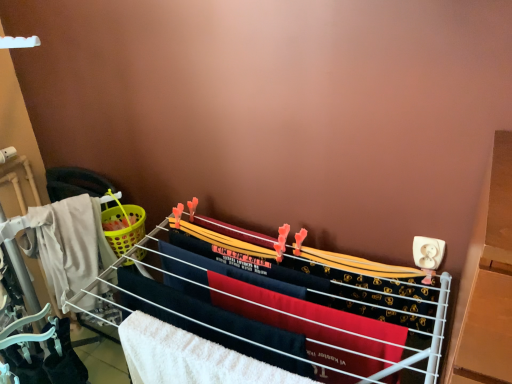
At what (x,y) coordinates should I click in order to perform the action: click on white fluffy beach towel at center. Please return your answer as a coordinate pair (x, y). The height and width of the screenshot is (384, 512). Looking at the image, I should click on (189, 357).

What do you see at coordinates (189, 357) in the screenshot? The height and width of the screenshot is (384, 512). I see `white fluffy beach towel at center` at bounding box center [189, 357].

Locate an element on the screen. The width and height of the screenshot is (512, 384). white fabric drying rack at center is located at coordinates (432, 339).

Describe the element at coordinates (432, 339) in the screenshot. I see `white fabric drying rack at center` at that location.

What are the coordinates of `white fluffy beach towel at center` in the screenshot? It's located at (189, 357).

Considering the relative positions of white fluffy beach towel at center and white fabric drying rack at center in the image provided, is white fluffy beach towel at center to the left of white fabric drying rack at center from the viewer's perspective?

Indeed, white fluffy beach towel at center is positioned on the left side of white fabric drying rack at center.

Is white fluffy beach towel at center positioned in front of white fabric drying rack at center?

No.

Consider the image. Which point is more distant from viewer, (243, 379) or (392, 371)?

The point (392, 371) is farther.

From the image's perspective, between white fluffy beach towel at center and white fabric drying rack at center, who is located below?

white fabric drying rack at center appears lower in the image.

From a real-world perspective, which is physically above, white fluffy beach towel at center or white fabric drying rack at center?

white fluffy beach towel at center is physically above.

Considering the relative sizes of white fluffy beach towel at center and white fabric drying rack at center in the image provided, is white fluffy beach towel at center thinner than white fabric drying rack at center?

Indeed, white fluffy beach towel at center has a lesser width compared to white fabric drying rack at center.

Considering the sizes of white fluffy beach towel at center and white fabric drying rack at center in the image, is white fluffy beach towel at center taller or shorter than white fabric drying rack at center?

white fluffy beach towel at center is shorter than white fabric drying rack at center.

Is white fluffy beach towel at center smaller than white fabric drying rack at center?

Yes, white fluffy beach towel at center is smaller than white fabric drying rack at center.

Based on the photo, would you say white fabric drying rack at center is part of white fluffy beach towel at center's contents?

Actually, white fabric drying rack at center is outside white fluffy beach towel at center.

Looking at this image, are white fluffy beach towel at center and white fabric drying rack at center far apart?

That's not correct — white fluffy beach towel at center is a little close to white fabric drying rack at center.

Is white fluffy beach towel at center oriented away from white fabric drying rack at center?

Correct, white fluffy beach towel at center is looking away from white fabric drying rack at center.

Can you tell me how much white fluffy beach towel at center and white fabric drying rack at center differ in facing direction?

1.86 degrees separate the facing orientations of white fluffy beach towel at center and white fabric drying rack at center.

How distant is white fluffy beach towel at center from white fabric drying rack at center?

white fluffy beach towel at center and white fabric drying rack at center are 11.36 inches apart from each other.

Locate an element on the screen. furniture below the white fluffy beach towel at center (from a real-world perspective) is located at coordinates (432, 339).

Which is more to the right, white fabric drying rack at center or white fluffy beach towel at center?

white fabric drying rack at center.

Considering the relative positions of white fabric drying rack at center and white fluffy beach towel at center in the image provided, is white fabric drying rack at center in front of white fluffy beach towel at center?

Yes, white fabric drying rack at center is in front of white fluffy beach towel at center.

Is point (436, 328) behind point (184, 369)?

That is False.

From the image's perspective, between white fabric drying rack at center and white fluffy beach towel at center, who is located below?

white fabric drying rack at center is shown below in the image.

Based on the photo, from a real-world perspective, which object rests below the other?

From a 3D spatial view, white fabric drying rack at center is below.

Between white fabric drying rack at center and white fluffy beach towel at center, which one has larger width?

white fabric drying rack at center.

Considering the relative sizes of white fabric drying rack at center and white fluffy beach towel at center in the image provided, is white fabric drying rack at center taller than white fluffy beach towel at center?

Correct, white fabric drying rack at center is much taller as white fluffy beach towel at center.

Is white fabric drying rack at center smaller than white fluffy beach towel at center?

Incorrect, white fabric drying rack at center is not smaller in size than white fluffy beach towel at center.

Does white fabric drying rack at center contain white fluffy beach towel at center?

Yes.

Is white fabric drying rack at center touching white fluffy beach towel at center?

No, white fabric drying rack at center is not in contact with white fluffy beach towel at center.

Is white fabric drying rack at center facing towards white fluffy beach towel at center?

Yes, white fabric drying rack at center is oriented towards white fluffy beach towel at center.

Can you tell me how much white fabric drying rack at center and white fluffy beach towel at center differ in facing direction?

There is a 1.86-degree angle between the facing directions of white fabric drying rack at center and white fluffy beach towel at center.

Image resolution: width=512 pixels, height=384 pixels. Identify the location of furniture on the right of the white fluffy beach towel at center. (432, 339).

This screenshot has width=512, height=384. I want to click on furniture that is under the white fluffy beach towel at center (from a real-world perspective), so click(x=432, y=339).

Identify the location of furniture below the white fluffy beach towel at center (from the image's perspective). (432, 339).